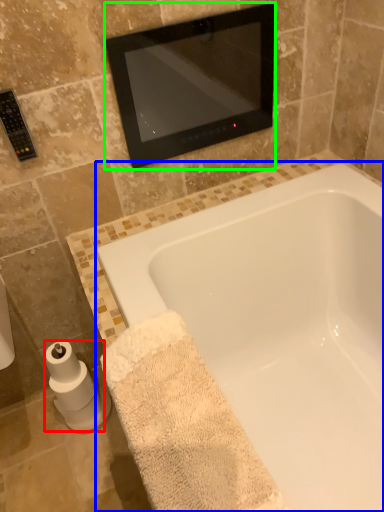
Question: Considering the real-world distances, which object is closest to toilet paper (highlighted by a red box)? bathtub (highlighted by a blue box) or mirror (highlighted by a green box).

Choices:
 (A) bathtub
 (B) mirror

Answer: (A)